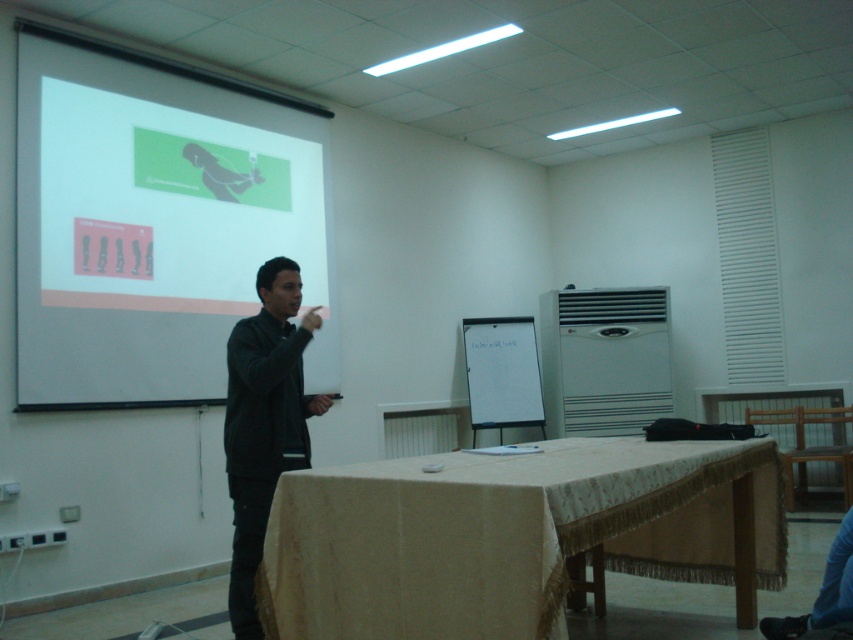
You are a student sitting in the classroom and need to take a photo of the white matte projection screen at upper left for your notes. The camera you have can only focus on objects within a 0.3 meter radius from the center point. If you aim your camera at the center of the screen, will the entire screen be in focus?

The white matte projection screen at upper left is located at point (149, 224). Since the camera can focus within a 0.3 meter radius from the center point, the entire screen should be in focus as long as its dimensions are within that radius. However, without knowing the screen size, we can only confirm the center is within range. Please ensure the screen fits within the focus area.

You are sitting in the classroom and want to see both points mentioned. Which point is closer to you, point (662,472) or point (502,365)?

Point (662,472) is in front of point (502,365), so it is closer to you.